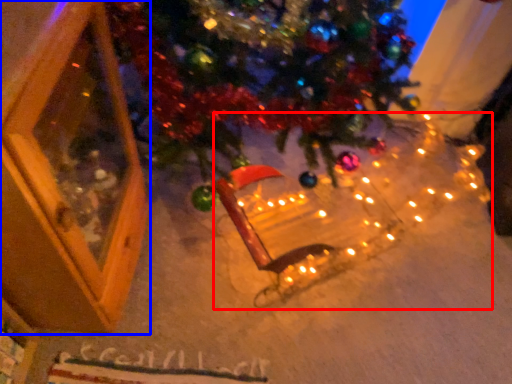
Question: Which object is further to the camera taking this photo, christmas light (highlighted by a red box) or screen door (highlighted by a blue box)?

Choices:
 (A) christmas light
 (B) screen door

Answer: (A)